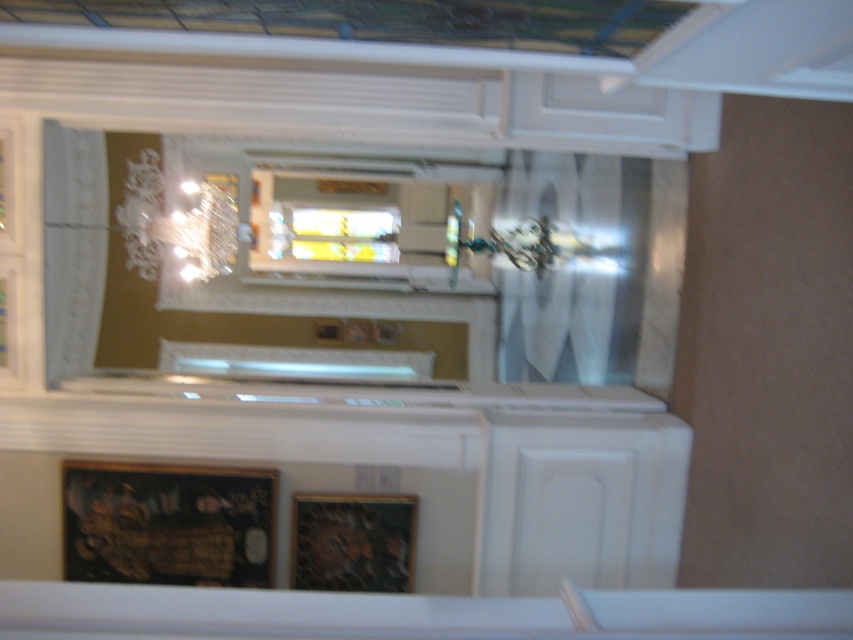
Can you confirm if white sheer curtain at center is thinner than clear glass window at center?

Yes.

Where is `white sheer curtain at center`? This screenshot has height=640, width=853. white sheer curtain at center is located at coordinates (575, 268).

Is point (553, 358) farther from camera compared to point (357, 236)?

That is False.

Image resolution: width=853 pixels, height=640 pixels. Find the location of `white sheer curtain at center`. white sheer curtain at center is located at coordinates (575, 268).

Who is higher up, white sheer curtain at center or matte gold chandelier at upper left?

Positioned higher is matte gold chandelier at upper left.

Can you confirm if white sheer curtain at center is positioned to the left of matte gold chandelier at upper left?

Incorrect, white sheer curtain at center is not on the left side of matte gold chandelier at upper left.

Find the location of a particular element. Image resolution: width=853 pixels, height=640 pixels. white sheer curtain at center is located at coordinates coord(575,268).

Which is in front, point (236, 212) or point (329, 256)?

Positioned in front is point (236, 212).

Is matte gold chandelier at upper left below clear glass window at center?

Yes, matte gold chandelier at upper left is below clear glass window at center.

You are a GUI agent. You are given a task and a screenshot of the screen. Output one action in this format:
    pyautogui.click(x=<x>, y=<y>)
    Task: Click on the matte gold chandelier at upper left
    Image resolution: width=853 pixels, height=640 pixels.
    Given the screenshot: What is the action you would take?
    pyautogui.click(x=177, y=224)